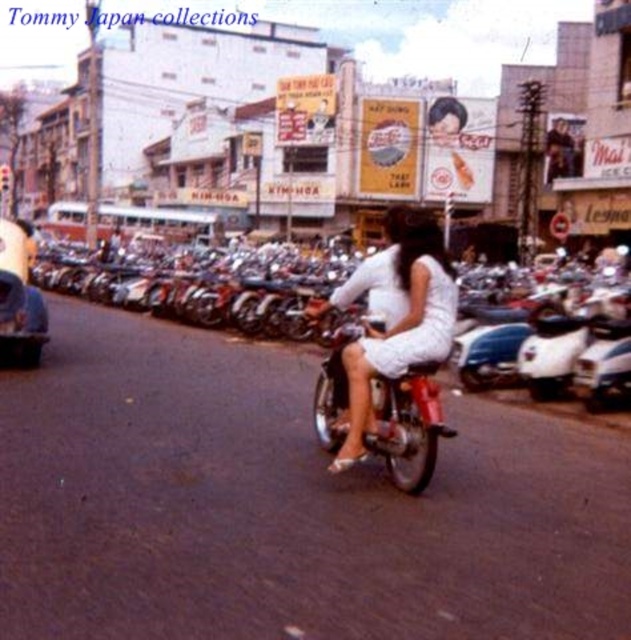
Is point (423, 486) in front of point (27, 314)?

Yes, it is in front of point (27, 314).

Is shiny chrome motorcycle at center bigger than metallic silver car at left?

Incorrect, shiny chrome motorcycle at center is not larger than metallic silver car at left.

Who is more forward, (x=416, y=460) or (x=25, y=339)?

Positioned in front is point (x=416, y=460).

This screenshot has width=631, height=640. I want to click on shiny chrome motorcycle at center, so click(408, 424).